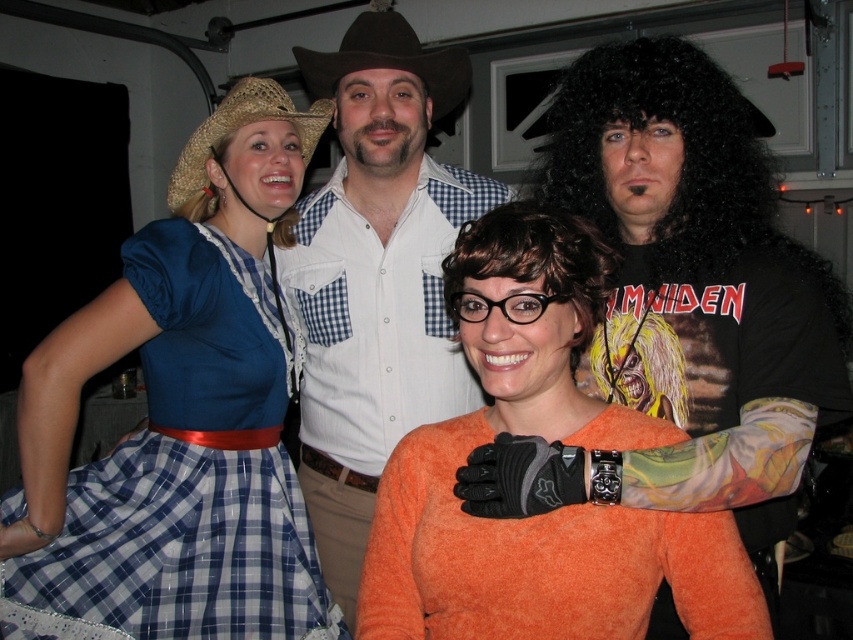
Question: Based on their relative distances, which object is farther from the strawhat at upper left?

Choices:
 (A) blue plaid dress at left
 (B) brown felt cowboy hat at upper center

Answer: (A)

Question: Does white checkered shirt at center appear on the left side of brown felt cowboy hat at upper center?

Choices:
 (A) yes
 (B) no

Answer: (B)

Question: Which object appears farthest from the camera in this image?

Choices:
 (A) white checkered shirt at center
 (B) brown felt cowboy hat at upper center
 (C) black leather jacket at center
 (D) strawhat at upper left

Answer: (B)

Question: Does orange fuzzy sweater at center have a greater width compared to brown felt cowboy hat at upper center?

Choices:
 (A) yes
 (B) no

Answer: (A)

Question: Which of the following is the closest to the observer?

Choices:
 (A) white checkered shirt at center
 (B) blue plaid dress at left
 (C) brown felt cowboy hat at upper center
 (D) black leather jacket at center

Answer: (D)

Question: Can you confirm if blue plaid dress at left is thinner than white checkered shirt at center?

Choices:
 (A) no
 (B) yes

Answer: (A)